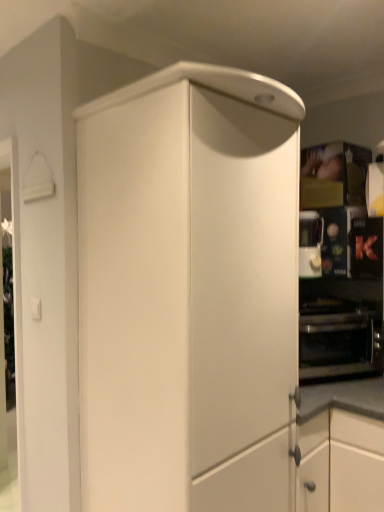
Question: Is the position of satin silver coffee machine at right less distant than that of black metallic oven at right?

Choices:
 (A) yes
 (B) no

Answer: (B)

Question: Is satin silver coffee machine at right located outside black metallic oven at right?

Choices:
 (A) yes
 (B) no

Answer: (A)

Question: From the image's perspective, is satin silver coffee machine at right on top of black metallic oven at right?

Choices:
 (A) yes
 (B) no

Answer: (A)

Question: From a real-world perspective, is satin silver coffee machine at right located beneath black metallic oven at right?

Choices:
 (A) yes
 (B) no

Answer: (B)

Question: Can you confirm if satin silver coffee machine at right is thinner than black metallic oven at right?

Choices:
 (A) yes
 (B) no

Answer: (A)

Question: Considering the positions of black matte oven at right and black metallic oven at right in the image, is black matte oven at right taller or shorter than black metallic oven at right?

Choices:
 (A) tall
 (B) short

Answer: (B)

Question: Based on their sizes in the image, would you say black matte oven at right is bigger or smaller than black metallic oven at right?

Choices:
 (A) big
 (B) small

Answer: (B)

Question: From a real-world perspective, is black matte oven at right positioned above or below black metallic oven at right?

Choices:
 (A) below
 (B) above

Answer: (B)

Question: From the image's perspective, relative to black metallic oven at right, is black matte oven at right above or below?

Choices:
 (A) below
 (B) above

Answer: (B)

Question: Is point (165, 197) closer or farther from the camera than point (355, 323)?

Choices:
 (A) farther
 (B) closer

Answer: (B)

Question: In terms of height, does matte white cabinet at center look taller or shorter compared to black metallic oven at right?

Choices:
 (A) tall
 (B) short

Answer: (A)

Question: Is matte white cabinet at center in front of or behind black metallic oven at right in the image?

Choices:
 (A) behind
 (B) front

Answer: (B)

Question: Is matte white cabinet at center wider or thinner than black metallic oven at right?

Choices:
 (A) wide
 (B) thin

Answer: (A)

Question: Considering the positions of black matte oven at right and satin silver coffee machine at right in the image, is black matte oven at right taller or shorter than satin silver coffee machine at right?

Choices:
 (A) short
 (B) tall

Answer: (A)

Question: In terms of width, does black matte oven at right look wider or thinner when compared to satin silver coffee machine at right?

Choices:
 (A) thin
 (B) wide

Answer: (A)